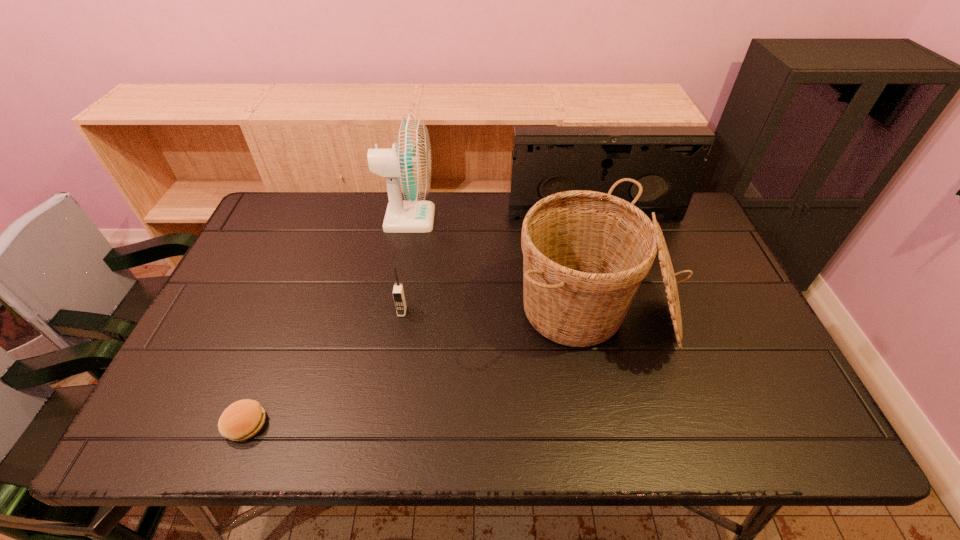
At what (x,y) coordinates should I click in order to perform the action: click on free space at the left edge. Please return your answer as a coordinate pair (x, y). This screenshot has width=960, height=540. Looking at the image, I should click on (252, 341).

Where is `vacant space at the right edge of the desktop`? The image size is (960, 540). vacant space at the right edge of the desktop is located at coordinates (756, 370).

Locate an element on the screen. The image size is (960, 540). free space between the fan and the basket is located at coordinates (501, 266).

Find the location of `vacant area that lies between the basket and the nearest object`. vacant area that lies between the basket and the nearest object is located at coordinates (420, 368).

Locate an element on the screen. This screenshot has width=960, height=540. free space between the basket and the second shortest object is located at coordinates (498, 312).

In order to click on unoccupied area between the patty and the videotape in this screenshot , I will do `click(420, 321)`.

I want to click on free space between the leftmost object and the cellular telephone, so click(324, 368).

I want to click on free space between the second shortest object and the videotape, so click(x=498, y=264).

Identify the location of free spot between the videotape and the fan. The image size is (960, 540). (501, 218).

You are a GUI agent. You are given a task and a screenshot of the screen. Output one action in this format:
    pyautogui.click(x=<x>, y=<y>)
    Task: Click on the free space that is in between the patty and the videotape
    The height and width of the screenshot is (540, 960).
    Given the screenshot: What is the action you would take?
    pyautogui.click(x=420, y=321)